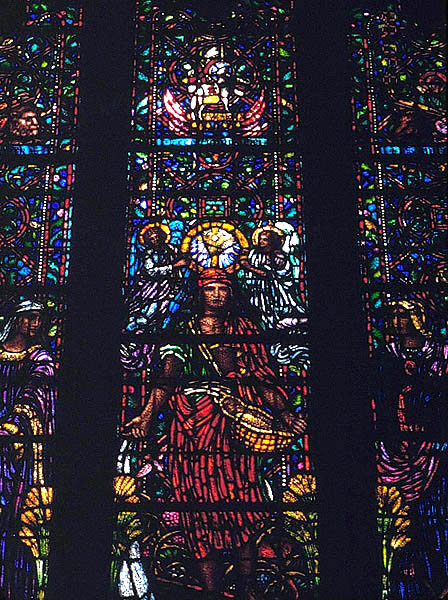
Where is `right colored window`? The height and width of the screenshot is (600, 448). right colored window is located at coordinates (396, 284).